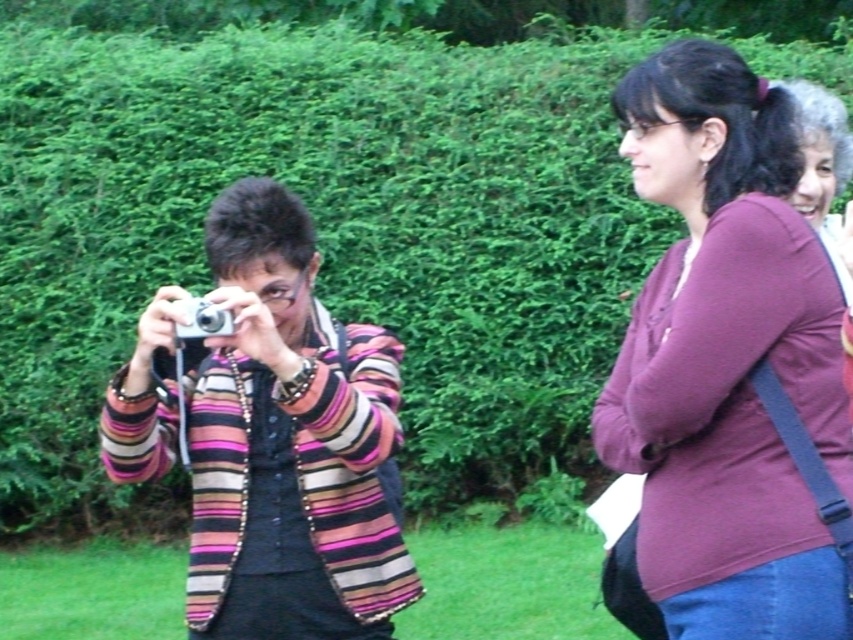
Question: Among these points, which one is nearest to the camera?

Choices:
 (A) click(418, 592)
 (B) click(201, 317)
 (C) click(691, 509)
 (D) click(851, 152)

Answer: (C)

Question: Is the position of purple cotton shirt at upper right more distant than that of maroon fabric shirt at right?

Choices:
 (A) no
 (B) yes

Answer: (A)

Question: Which of the following is the farthest from the observer?

Choices:
 (A) maroon fabric shirt at right
 (B) striped fabric camera at center

Answer: (B)

Question: Is purple cotton shirt at upper right smaller than striped fabric camera at center?

Choices:
 (A) no
 (B) yes

Answer: (B)

Question: Can you confirm if purple cotton shirt at upper right is positioned above silver metallic camera at left?

Choices:
 (A) yes
 (B) no

Answer: (B)

Question: Among these objects, which one is farthest from the camera?

Choices:
 (A) silver metallic camera at left
 (B) striped fabric camera at center

Answer: (A)